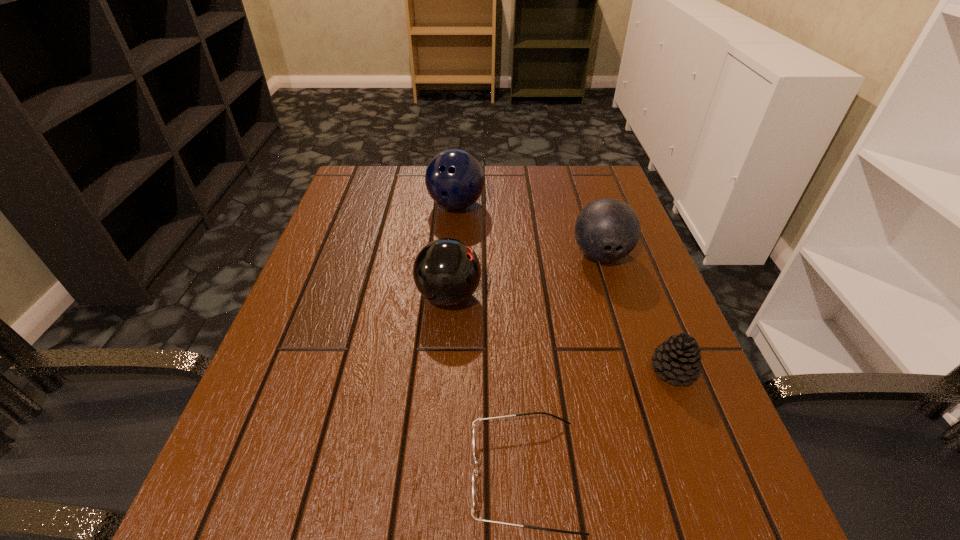
The width and height of the screenshot is (960, 540). Find the location of `vacant space at the left edge`. vacant space at the left edge is located at coordinates (348, 361).

Locate an element on the screen. The width and height of the screenshot is (960, 540). vacant region at the right edge of the desktop is located at coordinates (600, 288).

This screenshot has width=960, height=540. What are the coordinates of `blank space at the far left corner` in the screenshot? It's located at (389, 186).

Identify the location of free space at the far right corner of the desktop. pos(575,205).

Find the location of `free area in between the fourth farthest object and the farthest bowling ball`. free area in between the fourth farthest object and the farthest bowling ball is located at coordinates (x=564, y=287).

Locate an element on the screen. The width and height of the screenshot is (960, 540). vacant point located between the spectacles and the rightmost bowling ball is located at coordinates (563, 365).

At what (x,y) coordinates should I click in order to perform the action: click on vacant region between the farthest object and the second shortest object. Please return your answer as a coordinate pair (x, y). This screenshot has height=540, width=960. Looking at the image, I should click on (564, 287).

Identify the location of empty space that is in between the fourth tallest object and the shortest object. This screenshot has width=960, height=540. (599, 422).

Image resolution: width=960 pixels, height=540 pixels. What are the coordinates of `free point between the farthest bowling ball and the rightmost bowling ball` in the screenshot? It's located at (529, 230).

Where is `vacant area that lies between the pinecone and the rightmost bowling ball`? This screenshot has width=960, height=540. vacant area that lies between the pinecone and the rightmost bowling ball is located at coordinates (637, 313).